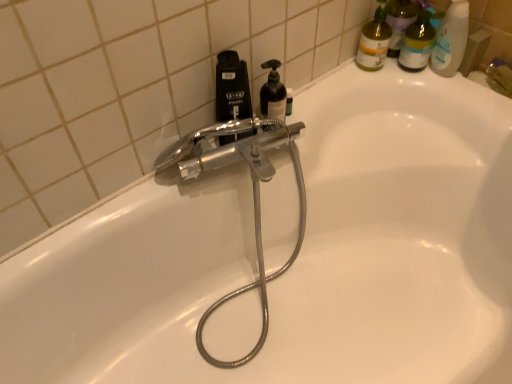
Question: Relative to translucent plastic bottles at upper right, is black matte soap dispenser at upper center in front or behind?

Choices:
 (A) front
 (B) behind

Answer: (A)

Question: From a real-world perspective, is black matte soap dispenser at upper center positioned above or below translucent plastic bottles at upper right?

Choices:
 (A) above
 (B) below

Answer: (B)

Question: Considering the real-world distances, which object is closest to the matte yellow bottle at upper right?

Choices:
 (A) translucent plastic bottles at upper right
 (B) black matte soap dispenser at upper center
 (C) black matte soap dispenser at upper center

Answer: (A)

Question: Based on their relative distances, which object is farther from the matte yellow bottle at upper right?

Choices:
 (A) black matte soap dispenser at upper center
 (B) black matte soap dispenser at upper center
 (C) translucent plastic bottles at upper right

Answer: (A)